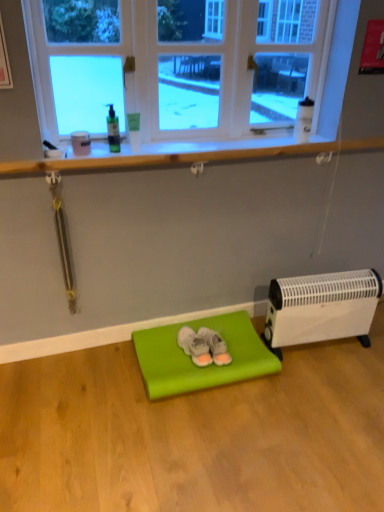
The width and height of the screenshot is (384, 512). Identify the location of free point below white plastic heater at lower right (from a real-world perspective). (321, 347).